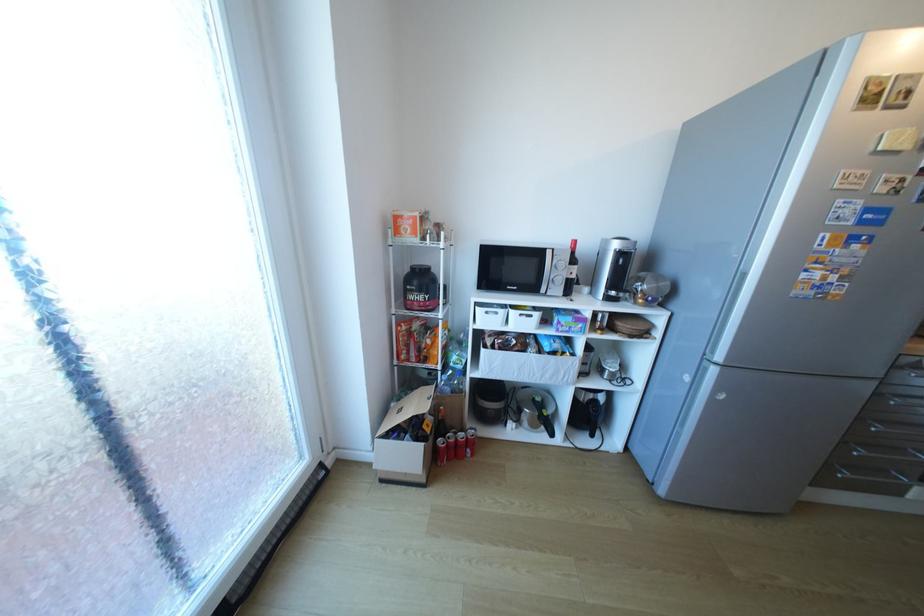
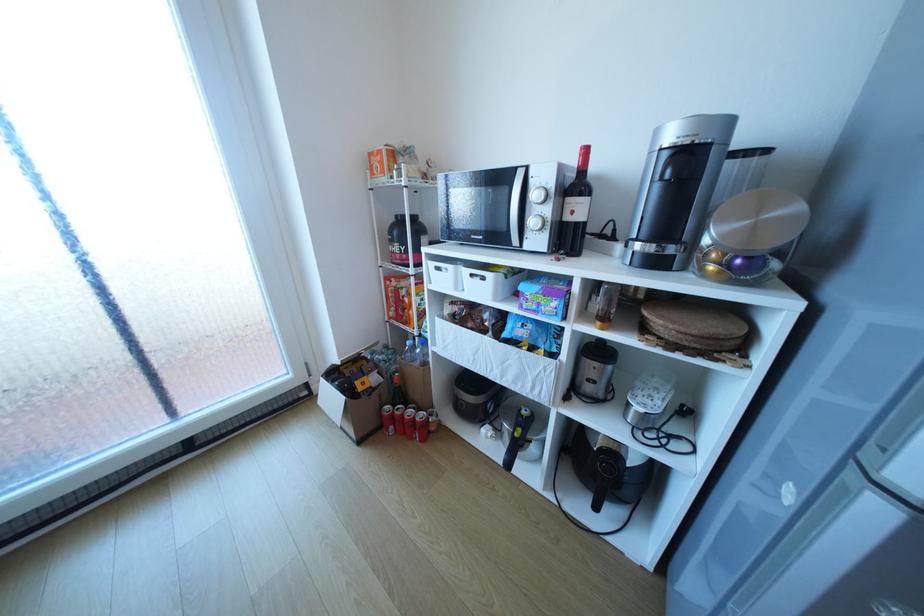
Locate, in the second image, the point that corresponds to [596,432] in the first image.

(599, 499)